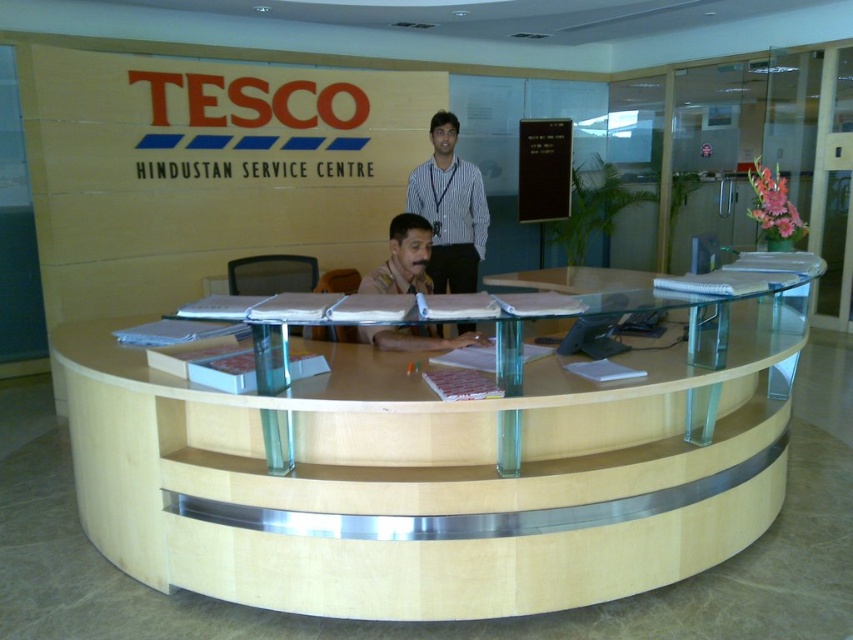
Question: From the image, what is the correct spatial relationship of light wood/woodenobject at center in relation to brown uniform at center?

Choices:
 (A) left
 (B) right

Answer: (B)

Question: Considering the real-world distances, which object is closest to the white striped shirt at upper center?

Choices:
 (A) brown uniform at center
 (B) light wood/woodenobject at center

Answer: (A)

Question: Considering the relative positions of white striped shirt at upper center and brown uniform at center in the image provided, where is white striped shirt at upper center located with respect to brown uniform at center?

Choices:
 (A) above
 (B) below

Answer: (A)

Question: Which point appears farthest from the camera in this image?

Choices:
 (A) (412, 291)
 (B) (579, 474)
 (C) (456, 259)

Answer: (C)

Question: Which point is farther from the camera taking this photo?

Choices:
 (A) (426, 172)
 (B) (431, 330)

Answer: (A)

Question: Does white striped shirt at upper center appear on the left side of brown uniform at center?

Choices:
 (A) no
 (B) yes

Answer: (A)